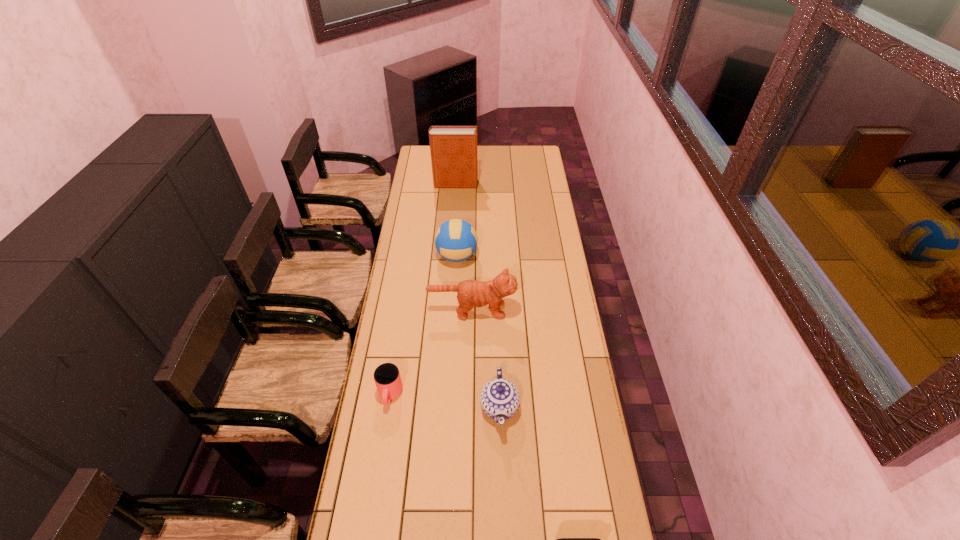
At what (x,y) coordinates should I click in order to perform the action: click on vacant space located at the spout of the chinaware. Please return your answer as a coordinate pair (x, y). The image size is (960, 540). Looking at the image, I should click on (502, 489).

The height and width of the screenshot is (540, 960). In order to click on free space located 0.310m on the handle side of the leftmost object in this screenshot , I will do pyautogui.click(x=372, y=508).

You are a GUI agent. You are given a task and a screenshot of the screen. Output one action in this format:
    pyautogui.click(x=<x>, y=<y>)
    Task: Click on the hardback book present at the left edge
    Image resolution: width=960 pixels, height=540 pixels.
    Given the screenshot: What is the action you would take?
    pyautogui.click(x=453, y=149)

I want to click on cup positioned at the left edge, so click(387, 378).

Identify the location of free location at the far edge. (490, 165).

I want to click on free space at the left edge, so click(x=418, y=193).

In the image, there is a desktop. Where is `vacant space at the right edge`? vacant space at the right edge is located at coordinates click(561, 356).

Identify the location of free spot between the fifth nearest object and the chinaware. (478, 332).

Where is `vacant space that is in between the chinaware and the fifth nearest object`? vacant space that is in between the chinaware and the fifth nearest object is located at coordinates (478, 332).

At what (x,y) coordinates should I click in order to perform the action: click on free space between the chinaware and the leftmost object. Please return your answer as a coordinate pair (x, y). This screenshot has height=540, width=960. Looking at the image, I should click on (444, 401).